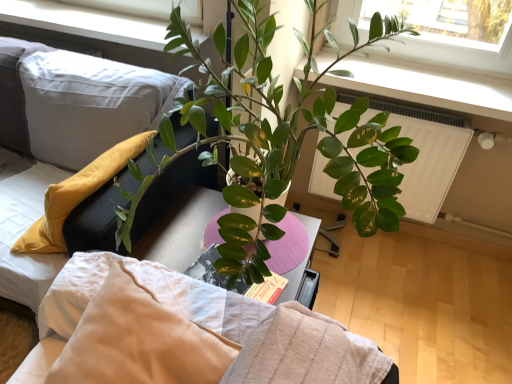
Question: Is white textured pillow at upper left to the left or to the right of white plastic window frame at upper center in the image?

Choices:
 (A) right
 (B) left

Answer: (A)

Question: In terms of width, does white textured pillow at upper left look wider or thinner when compared to white plastic window frame at upper center?

Choices:
 (A) thin
 (B) wide

Answer: (B)

Question: Estimate the real-world distances between objects in this image. Which object is farther from the white textured pillow at upper left?

Choices:
 (A) white plastic radiator at upper right
 (B) white textured bed at center
 (C) soft white fabric couch at left
 (D) white plastic window frame at upper center

Answer: (D)

Question: Which object is positioned farthest from the white plastic radiator at upper right?

Choices:
 (A) soft white fabric couch at left
 (B) white textured bed at center
 (C) white textured pillow at upper left
 (D) white plastic window frame at upper center

Answer: (D)